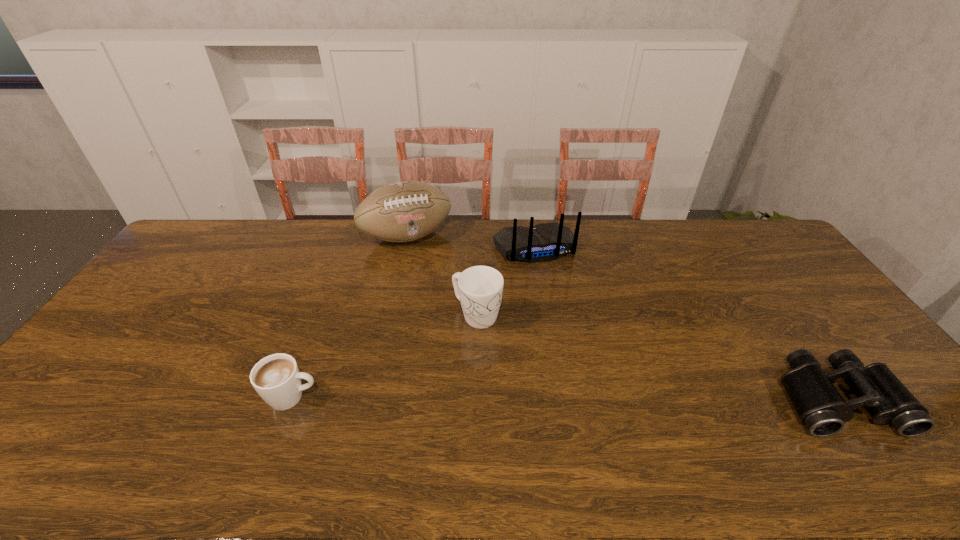
Image resolution: width=960 pixels, height=540 pixels. What are the coordinates of `cappuccino` in the screenshot? It's located at (276, 378).

At what (x,y) coordinates should I click in order to perform the action: click on binoculars. Please return your answer as a coordinate pair (x, y). Looking at the image, I should click on (820, 407).

Locate an element on the screen. This screenshot has height=540, width=960. router is located at coordinates (543, 242).

You are a GUI agent. You are given a task and a screenshot of the screen. Output one action in this format:
    pyautogui.click(x=<x>, y=<y>)
    Task: Click on the third farthest object
    
    Given the screenshot: What is the action you would take?
    pyautogui.click(x=479, y=289)

Locate an element on the screen. the third tallest object is located at coordinates (479, 289).

Find the location of a particular element. football (American) is located at coordinates (404, 211).

Identify the location of vacant point located 0.360m with the handle on the side of the cappuccino. The width and height of the screenshot is (960, 540). (459, 397).

You are a GUI agent. You are given a task and a screenshot of the screen. Output one action in this format:
    pyautogui.click(x=<x>, y=<y>)
    Task: Click on the vacant region located on the back of the router
    The width and height of the screenshot is (960, 540).
    Given the screenshot: What is the action you would take?
    pyautogui.click(x=566, y=318)

You are a GUI agent. You are given a task and a screenshot of the screen. Output one action in this format:
    pyautogui.click(x=<x>, y=<y>)
    Task: Click on the vacant point located on the back of the router
    Image resolution: width=960 pixels, height=540 pixels.
    Given the screenshot: What is the action you would take?
    pyautogui.click(x=558, y=298)

At what (x,y) coordinates should I click in order to perform the action: click on vacant space located on the back of the router. Please return your answer as a coordinate pair (x, y). Image resolution: width=960 pixels, height=540 pixels. Looking at the image, I should click on (550, 281).